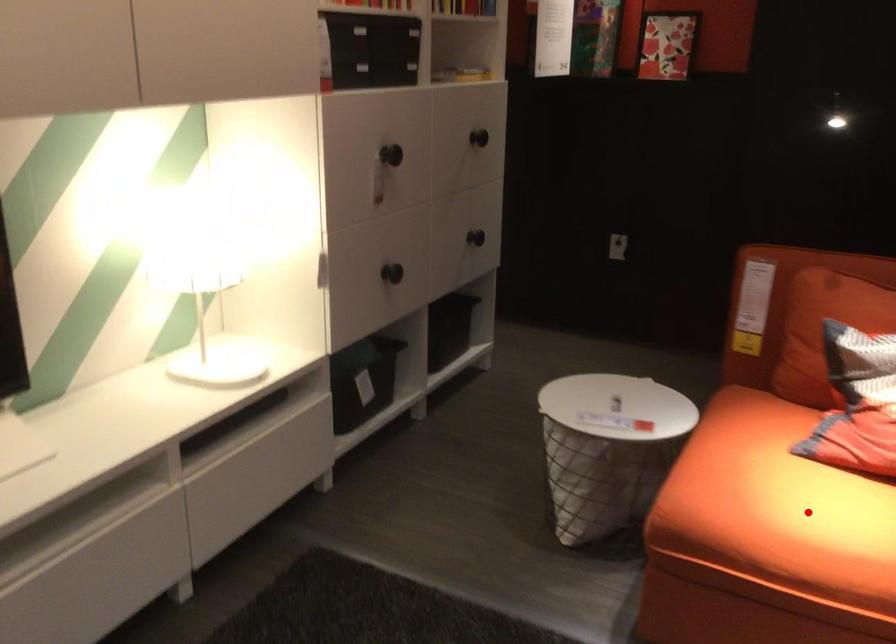
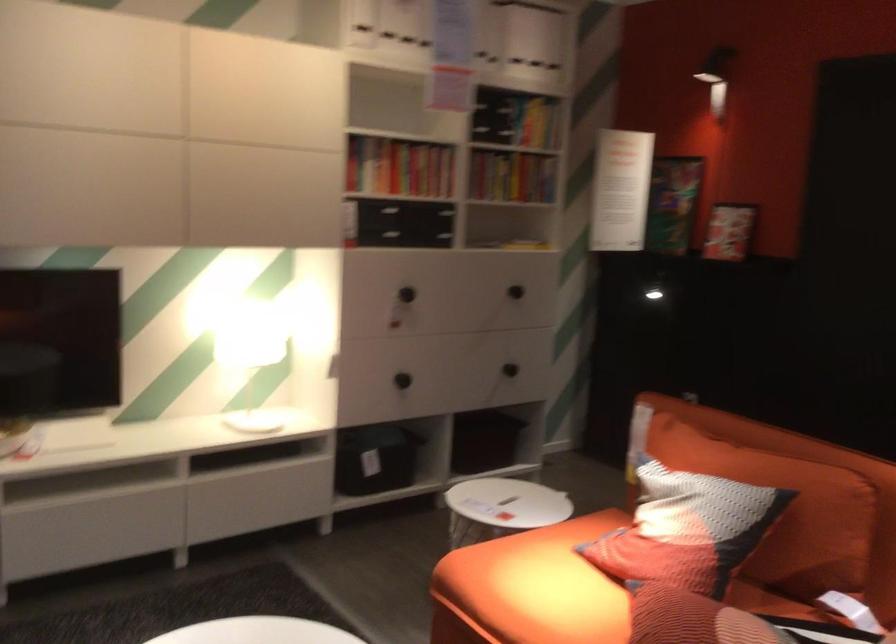
Question: I am providing you with two images of the same scene from different viewpoints. A red point is shown in image1. For the corresponding object point in image2, is it positioned nearer or farther from the camera?

Choices:
 (A) Nearer
 (B) Farther

Answer: (B)